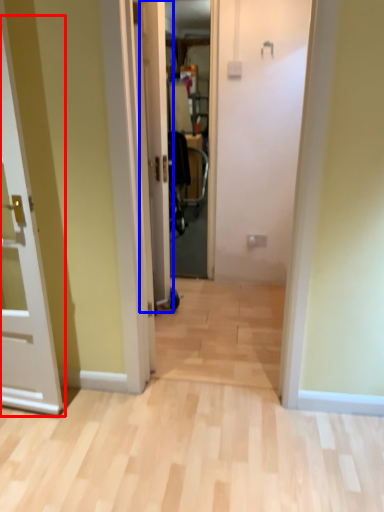
Question: Which object appears farthest to the camera in this image, door (highlighted by a red box) or door (highlighted by a blue box)?

Choices:
 (A) door
 (B) door

Answer: (B)